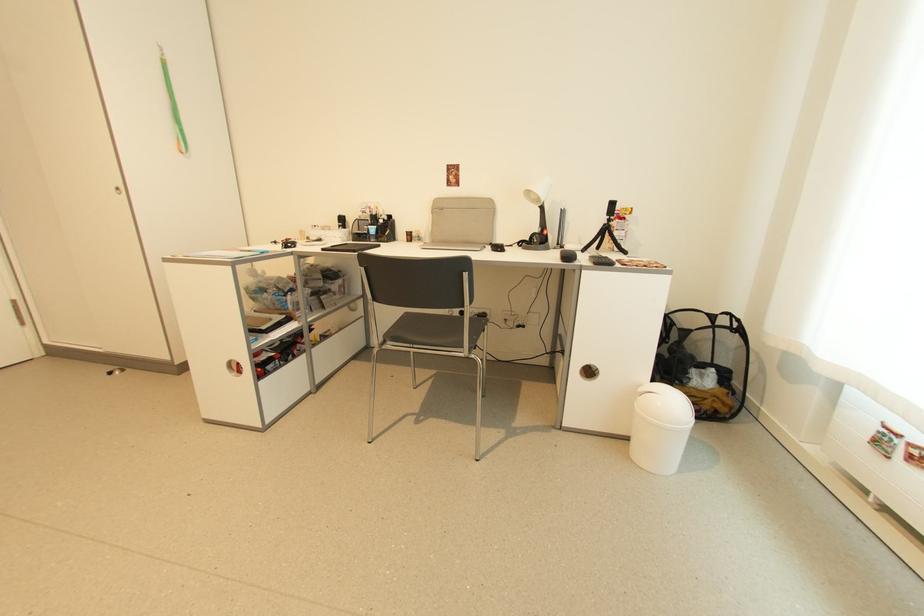
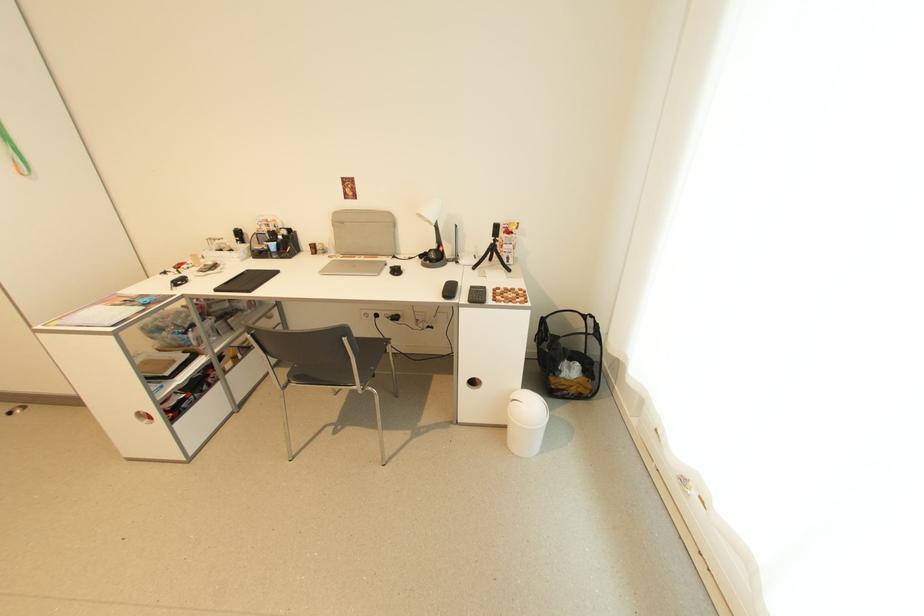
Where in the second image is the point corresponding to (x=600, y=265) from the first image?

(473, 302)